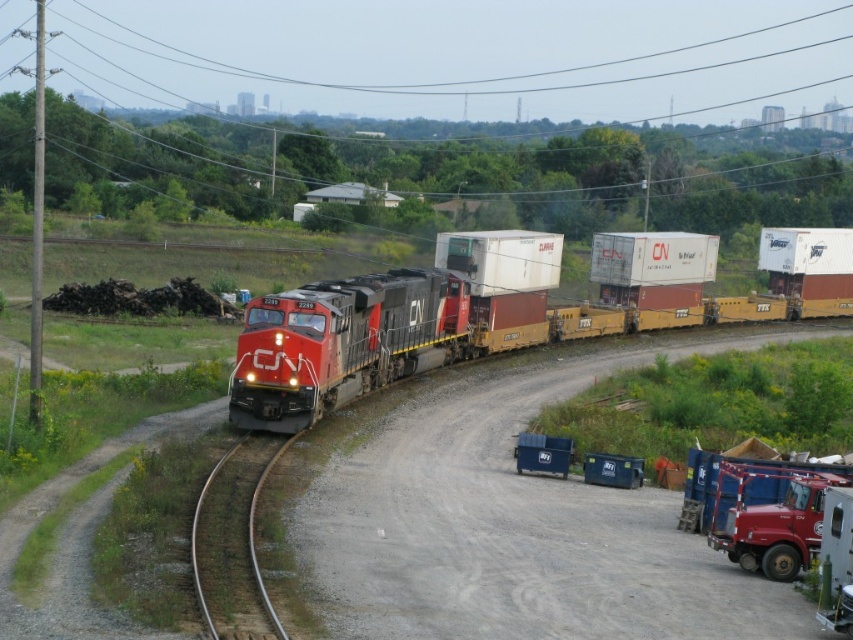
Based on the photo, is red glossy locomotive at center bigger than metal at left?

Indeed, red glossy locomotive at center has a larger size compared to metal at left.

Does red glossy locomotive at center have a smaller size compared to metal at left?

No.

Locate an element on the screen. red glossy locomotive at center is located at coordinates (389, 324).

Identify the location of red glossy locomotive at center. Image resolution: width=853 pixels, height=640 pixels. (389, 324).

Can you confirm if red glossy locomotive at center is positioned to the left of red glossy trailer truck at lower right?

Yes, red glossy locomotive at center is to the left of red glossy trailer truck at lower right.

Is point (358, 278) farther from viewer compared to point (694, 456)?

Yes, it is behind point (694, 456).

Image resolution: width=853 pixels, height=640 pixels. I want to click on red glossy locomotive at center, so click(x=389, y=324).

Between red glossy trailer truck at lower right and metal at left, which one is positioned lower?

Positioned lower is metal at left.

Is point (740, 480) behind point (271, 618)?

Yes, it is.

I want to click on red glossy trailer truck at lower right, so click(759, 508).